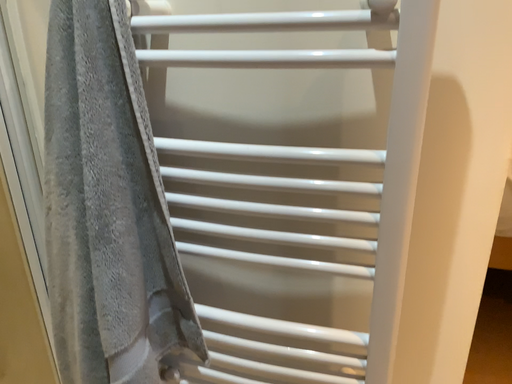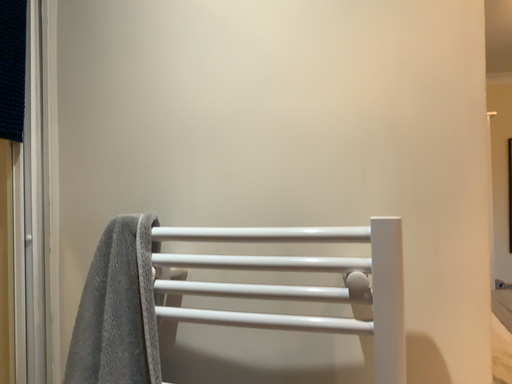
Question: How did the camera likely rotate when shooting the video?

Choices:
 (A) rotated upward
 (B) rotated downward

Answer: (A)